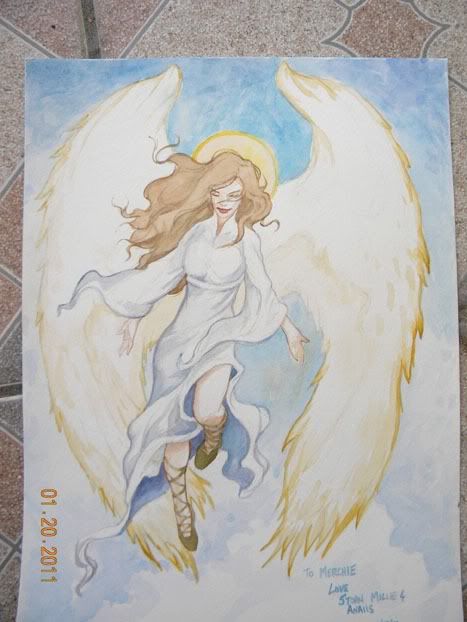
You are a GUI agent. You are given a task and a screenshot of the screen. Output one action in this format:
    pyautogui.click(x=<x>, y=<y>)
    Task: Click on the tile floor
    This screenshot has width=467, height=622.
    Given the screenshot: What is the action you would take?
    pyautogui.click(x=212, y=22)